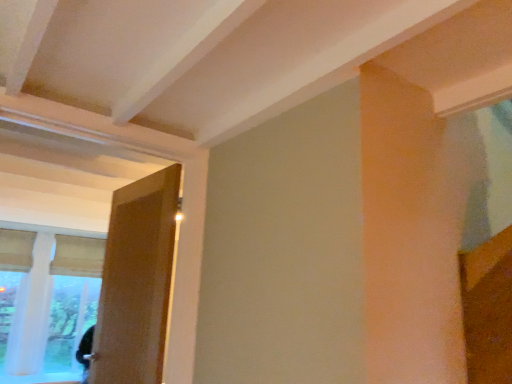
Question: Is point (99, 248) closer or farther from the camera than point (161, 190)?

Choices:
 (A) farther
 (B) closer

Answer: (A)

Question: From the image's perspective, is white sheer curtain at left positioned above or below wooden door at left?

Choices:
 (A) above
 (B) below

Answer: (B)

Question: Do you think white sheer curtain at left is within wooden door at left, or outside of it?

Choices:
 (A) outside
 (B) inside

Answer: (A)

Question: Is point (117, 256) closer or farther from the camera than point (4, 360)?

Choices:
 (A) closer
 (B) farther

Answer: (A)

Question: Based on their sizes in the image, would you say wooden door at left is bigger or smaller than white sheer curtain at left?

Choices:
 (A) big
 (B) small

Answer: (B)

Question: Is wooden door at left in front of or behind white sheer curtain at left in the image?

Choices:
 (A) behind
 (B) front

Answer: (B)

Question: Visually, is wooden door at left positioned to the left or to the right of white sheer curtain at left?

Choices:
 (A) left
 (B) right

Answer: (B)